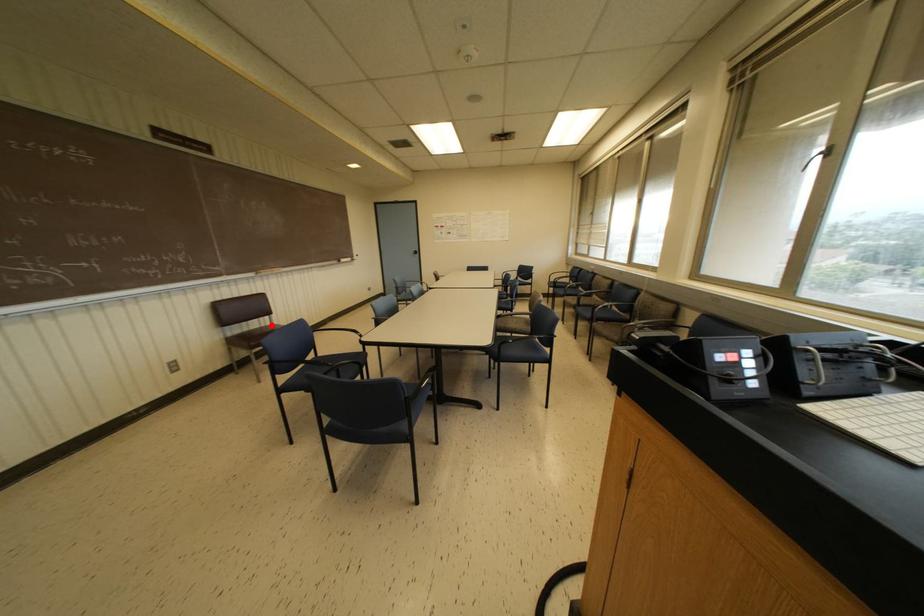
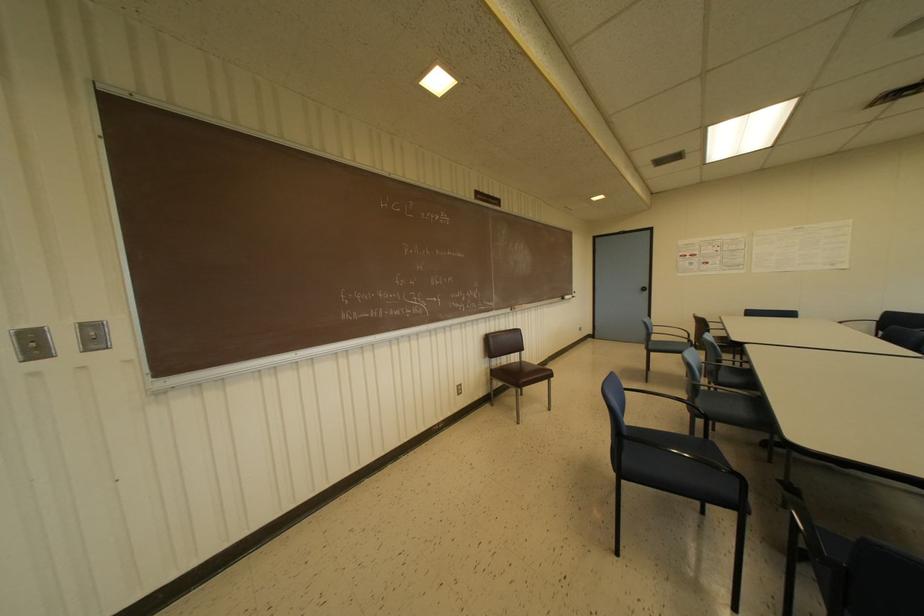
Where in the second image is the point corresponding to the highlighted location from the first image?

(519, 362)